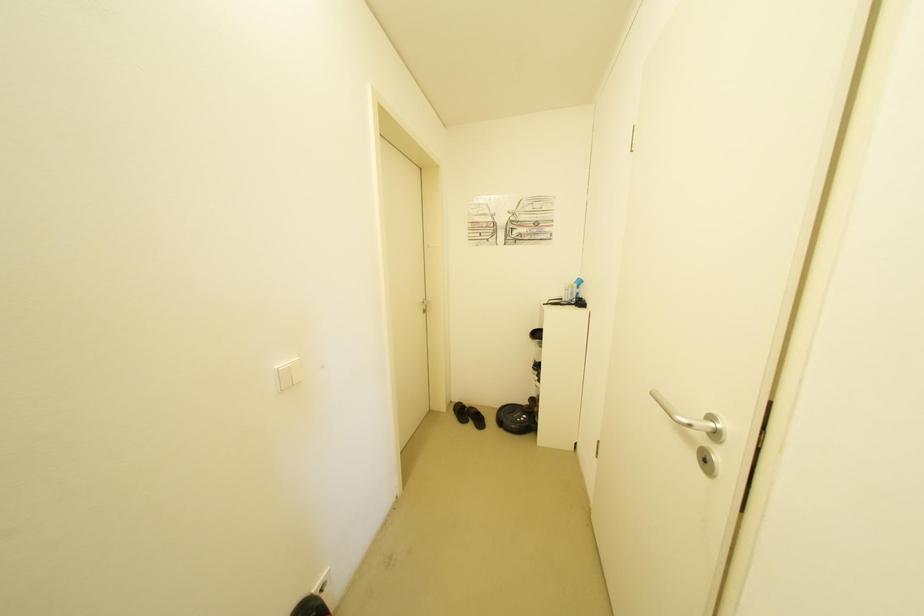
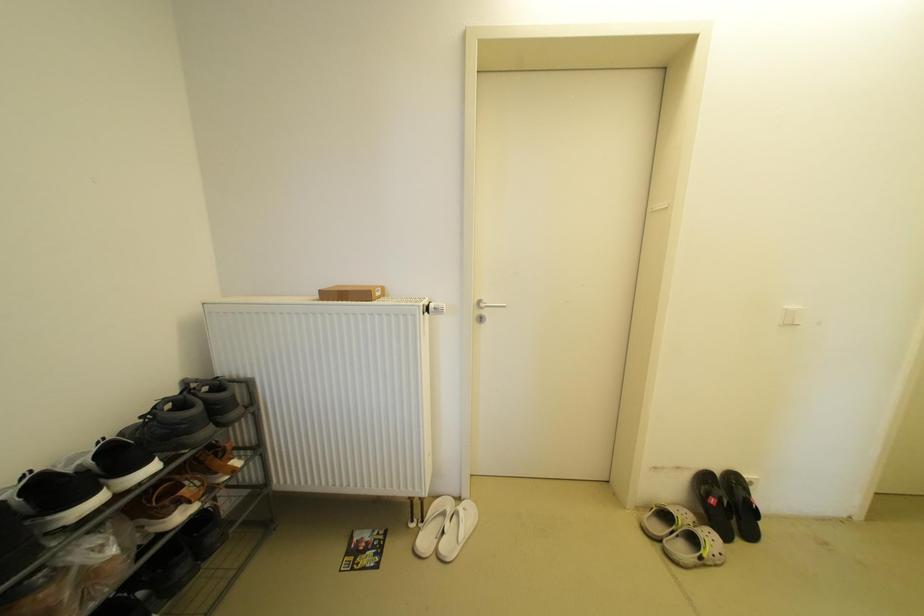
Question: How did the camera likely rotate?

Choices:
 (A) Left
 (B) Right
 (C) Up
 (D) Down

Answer: (A)